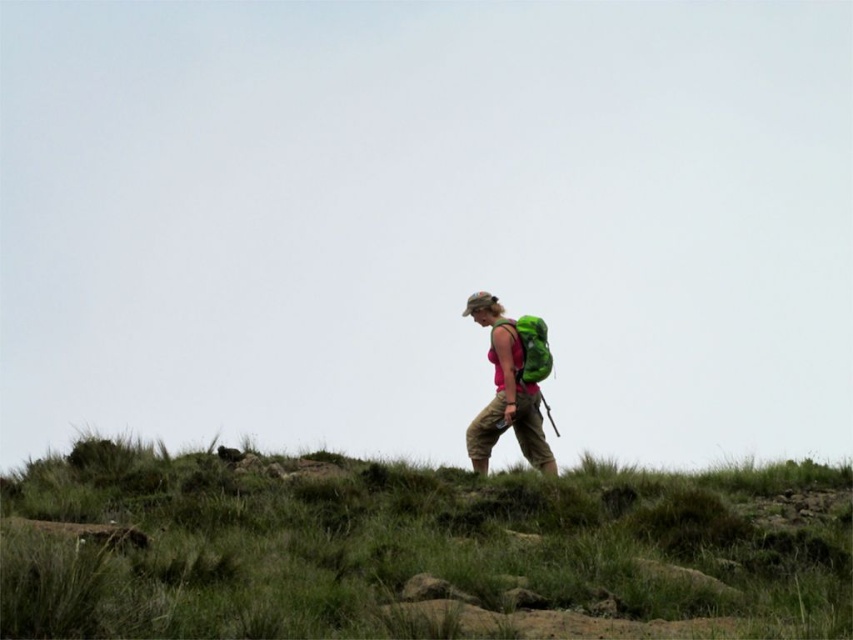
You are taking a photo of the hiker and want to focus on two specific points in the image. The first point is at coordinate point (581,582) and the second is at coordinate point (532,458). Which point should you focus on first if you want to ensure the closest point is in focus?

Point (581,582) is closer to the camera than point (532,458), so you should focus on point (581,582) first to ensure the closest point is in focus.